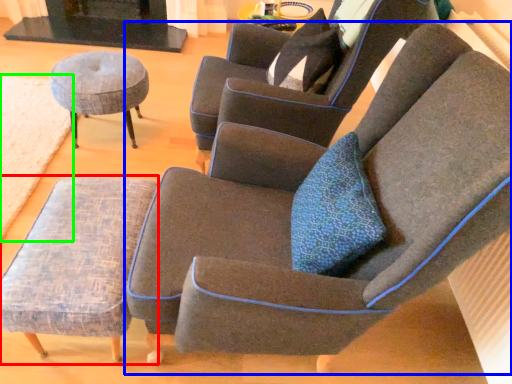
Question: Which is farther away from stool (highlighted by a red box)? chair (highlighted by a blue box) or mat (highlighted by a green box)?

Choices:
 (A) chair
 (B) mat

Answer: (B)